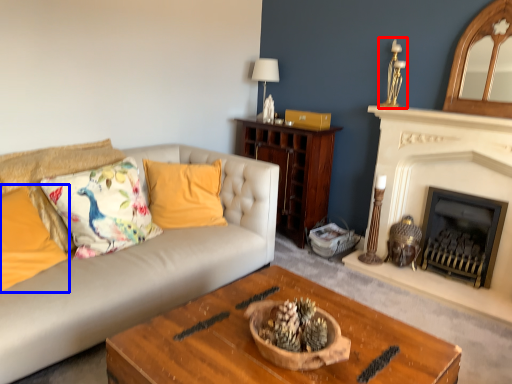
Question: Which point is further to the camera, candle holder (highlighted by a red box) or pillow (highlighted by a blue box)?

Choices:
 (A) candle holder
 (B) pillow

Answer: (A)